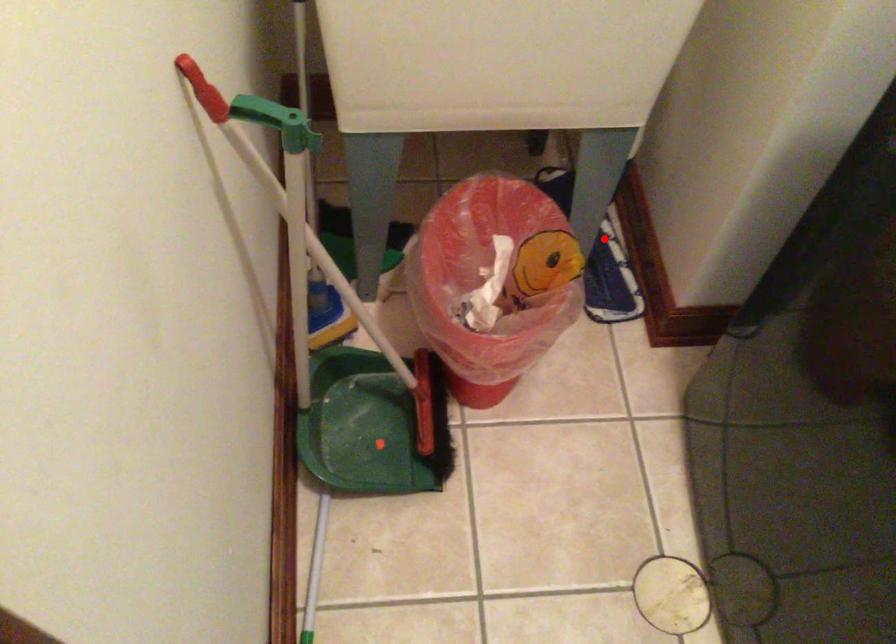
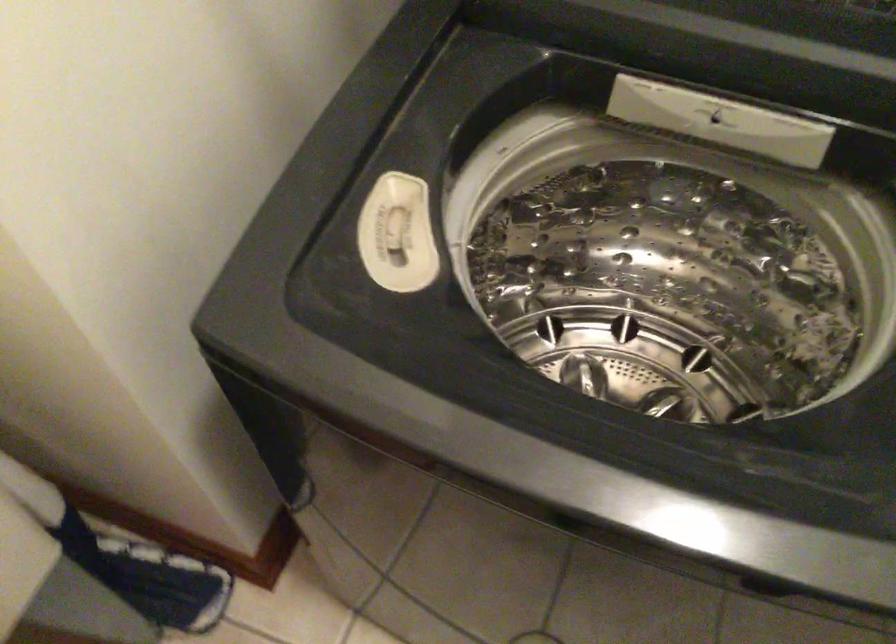
Question: I am providing you with two images of the same scene from different viewpoints. Given a red point in image1, look at the same physical point in image2. Is it:

Choices:
 (A) Closer to the viewpoint
 (B) Farther from the viewpoint

Answer: (A)